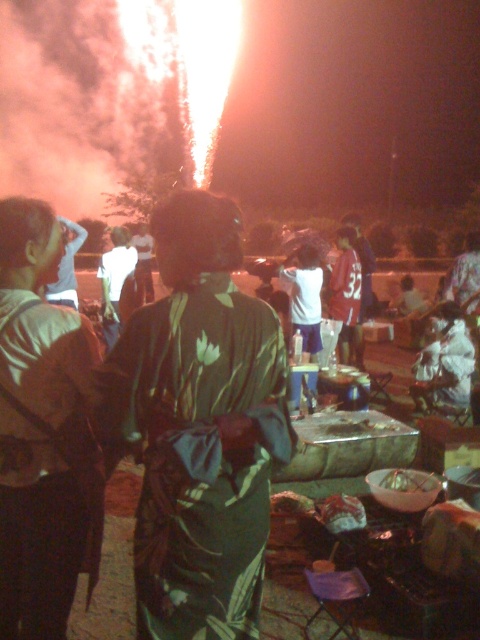
Question: Is green silk kimono at center below shiny metallic bowl at center?

Choices:
 (A) no
 (B) yes

Answer: (A)

Question: Can you confirm if green fabric dress at center is thinner than maroon jersey at center?

Choices:
 (A) no
 (B) yes

Answer: (A)

Question: Does matte green dress at center lie behind dark green fabric at center?

Choices:
 (A) no
 (B) yes

Answer: (A)

Question: Which object appears farthest from the camera in this image?

Choices:
 (A) matte green dress at center
 (B) dark green fabric at center
 (C) shiny metallic bowl at center

Answer: (B)

Question: Which object appears farthest from the camera in this image?

Choices:
 (A) white fabric at lower right
 (B) white cotton shirt at center

Answer: (B)

Question: Which of the following is the farthest from the observer?

Choices:
 (A) (73, 276)
 (B) (431, 484)

Answer: (A)